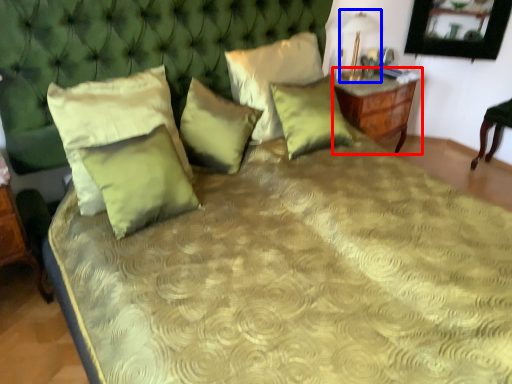
Question: Among these objects, which one is nearest to the camera, nightstand (highlighted by a red box) or table lamp (highlighted by a blue box)?

Choices:
 (A) nightstand
 (B) table lamp

Answer: (B)